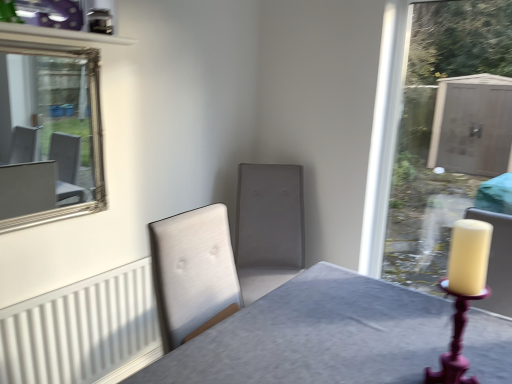
In order to click on free point above silver/glass mirror at upper left (from a real-world perspective) in this screenshot , I will do [47, 47].